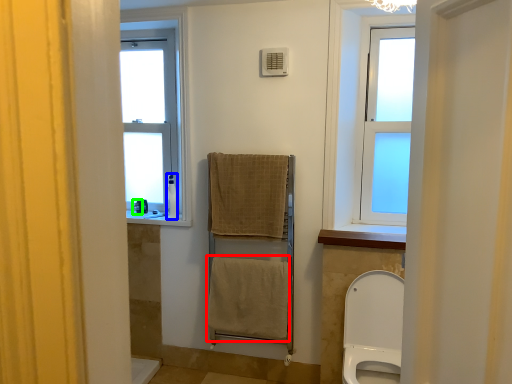
Question: Which object is positioned closest to bath towel (highlighted by a red box)? Select from toiletry (highlighted by a blue box) and toiletry (highlighted by a green box).

Choices:
 (A) toiletry
 (B) toiletry

Answer: (A)